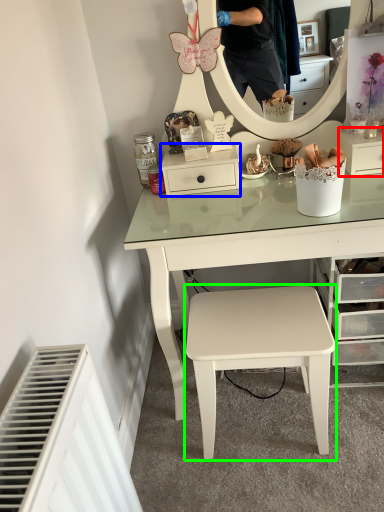
Question: Which object is positioned farthest from shelf (highlighted by a red box)? Select from shelf (highlighted by a blue box) and stool (highlighted by a green box).

Choices:
 (A) shelf
 (B) stool

Answer: (B)